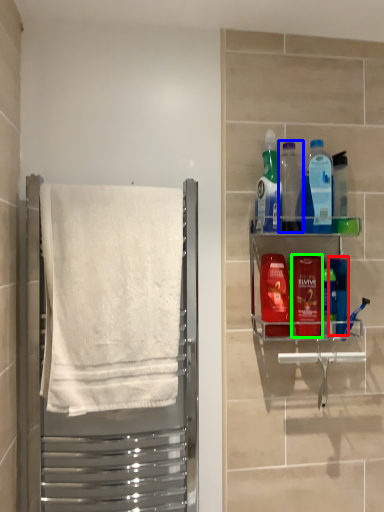
Question: Which object is positioned farthest from mouthwash (highlighted by a red box)? Select from bottle (highlighted by a blue box) and mouthwash (highlighted by a green box).

Choices:
 (A) bottle
 (B) mouthwash

Answer: (A)